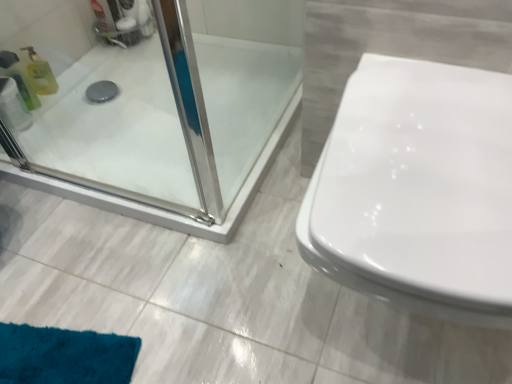
Question: Is translucent yellow bottle at left, the first cleaning product positioned from the front, to the left or to the right of translucent plastic bottle at left, which ranks as the first cleaning product in back-to-front order, in the image?

Choices:
 (A) left
 (B) right

Answer: (A)

Question: From a real-world perspective, is translucent yellow bottle at left, the second cleaning product positioned from the back, above or below translucent plastic bottle at left, the 2th cleaning product positioned from the front?

Choices:
 (A) below
 (B) above

Answer: (B)

Question: Which of these objects is positioned farthest from the transparent plastic toilet paper at upper left?

Choices:
 (A) translucent yellow bottle at left, the first cleaning product positioned from the front
 (B) white glossy toilet at right
 (C) translucent plastic bottle at left, the 2th cleaning product positioned from the front

Answer: (B)

Question: Estimate the real-world distances between objects in this image. Which object is closer to the transparent plastic toilet paper at upper left?

Choices:
 (A) white glossy toilet at right
 (B) translucent yellow bottle at left, the second cleaning product positioned from the back
 (C) translucent plastic bottle at left, the 2th cleaning product positioned from the front

Answer: (B)